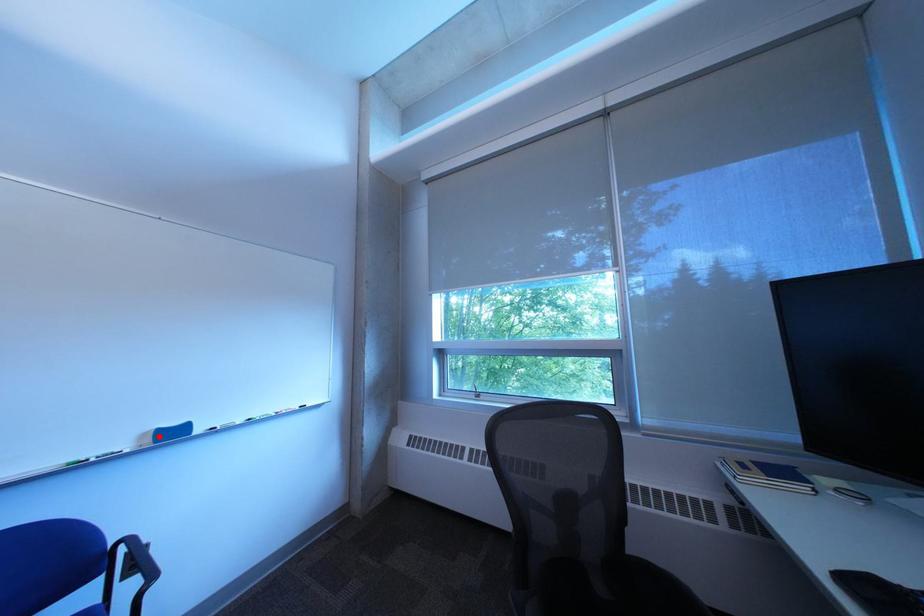
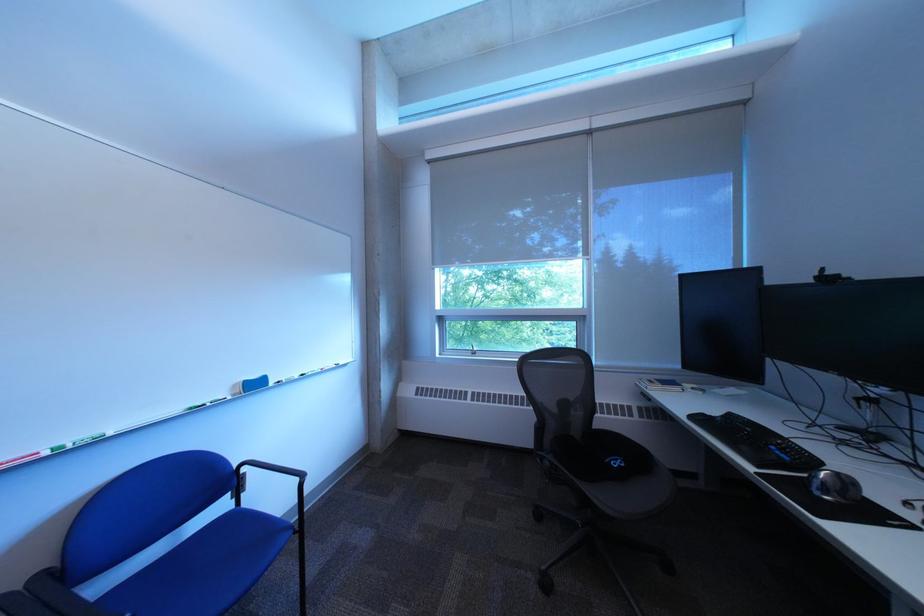
Find the pixel in the second image that matches the highlighted location in the first image.

(249, 387)